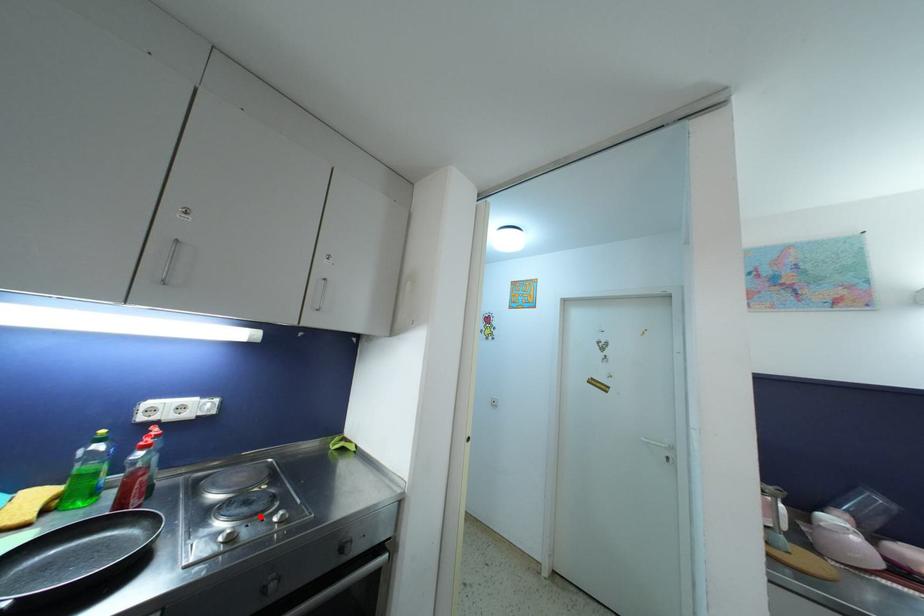
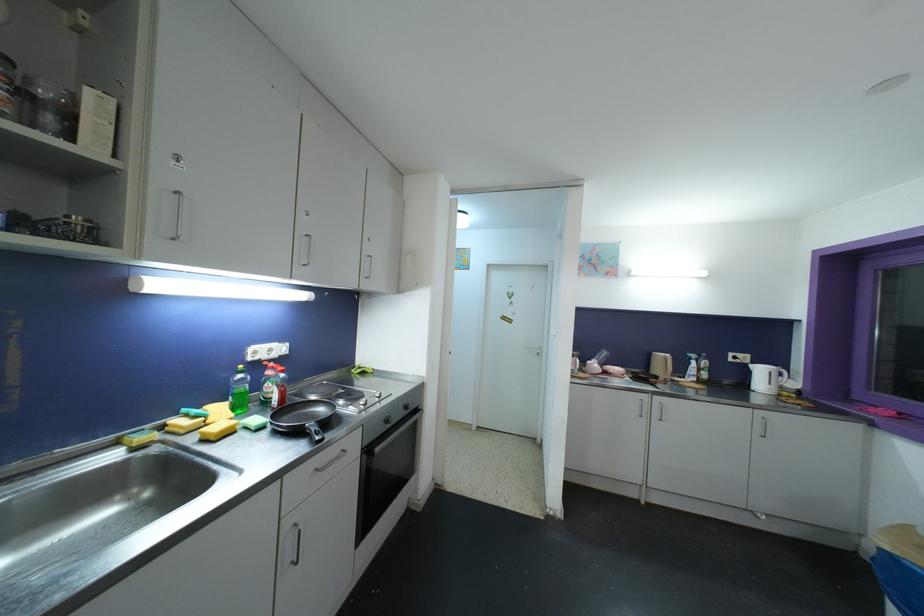
Where in the second image is the point corresponding to the highlighted location from the first image?

(366, 400)